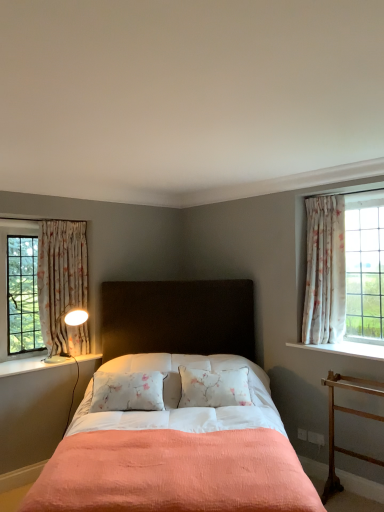
Question: Is wooden at right not inside floral fabric curtain at left, marked as the first curtain in a left-to-right arrangement?

Choices:
 (A) yes
 (B) no

Answer: (A)

Question: Is wooden at right looking in the opposite direction of floral fabric curtain at left, marked as the first curtain in a left-to-right arrangement?

Choices:
 (A) no
 (B) yes

Answer: (A)

Question: Is wooden at right far from floral fabric curtain at left, marked as the first curtain in a left-to-right arrangement?

Choices:
 (A) no
 (B) yes

Answer: (B)

Question: Considering the relative positions of wooden at right and floral fabric curtain at left, marked as the first curtain in a left-to-right arrangement, in the image provided, is wooden at right behind floral fabric curtain at left, marked as the first curtain in a left-to-right arrangement,?

Choices:
 (A) yes
 (B) no

Answer: (B)

Question: From a real-world perspective, is wooden at right over floral fabric curtain at left, marked as the first curtain in a left-to-right arrangement?

Choices:
 (A) no
 (B) yes

Answer: (A)

Question: In terms of height, does floral fabric curtain at left, positioned as the 2th curtain in right-to-left order, look taller or shorter compared to white painted wood at right, which is counted as the first window sill, starting from the right?

Choices:
 (A) short
 (B) tall

Answer: (B)

Question: Is floral fabric curtain at left, positioned as the 2th curtain in right-to-left order, bigger or smaller than white painted wood at right, arranged as the 2th window sill when viewed from the left?

Choices:
 (A) small
 (B) big

Answer: (B)

Question: From a real-world perspective, is floral fabric curtain at left, marked as the first curtain in a left-to-right arrangement, physically located above or below white painted wood at right, which is the 1th window sill from top to bottom?

Choices:
 (A) above
 (B) below

Answer: (A)

Question: Do you think floral fabric curtain at left, marked as the first curtain in a left-to-right arrangement, is within white painted wood at right, arranged as the 2th window sill when viewed from the left, or outside of it?

Choices:
 (A) inside
 (B) outside

Answer: (B)

Question: In the image, is matte black headboard at center on the left side or the right side of floral fabric curtain at right, the second curtain viewed from the left?

Choices:
 (A) right
 (B) left

Answer: (B)

Question: In terms of height, does matte black headboard at center look taller or shorter compared to floral fabric curtain at right, marked as the first curtain in a right-to-left arrangement?

Choices:
 (A) short
 (B) tall

Answer: (B)

Question: Looking at their shapes, would you say matte black headboard at center is wider or thinner than floral fabric curtain at right, marked as the first curtain in a right-to-left arrangement?

Choices:
 (A) thin
 (B) wide

Answer: (B)

Question: From a real-world perspective, is matte black headboard at center physically located above or below floral fabric curtain at right, marked as the first curtain in a right-to-left arrangement?

Choices:
 (A) above
 (B) below

Answer: (B)

Question: From the image's perspective, relative to floral fabric curtain at left, marked as the first curtain in a left-to-right arrangement, is matte white table lamp at left above or below?

Choices:
 (A) above
 (B) below

Answer: (B)

Question: Considering the positions of matte white table lamp at left and floral fabric curtain at left, positioned as the 2th curtain in right-to-left order, in the image, is matte white table lamp at left bigger or smaller than floral fabric curtain at left, positioned as the 2th curtain in right-to-left order,?

Choices:
 (A) big
 (B) small

Answer: (B)